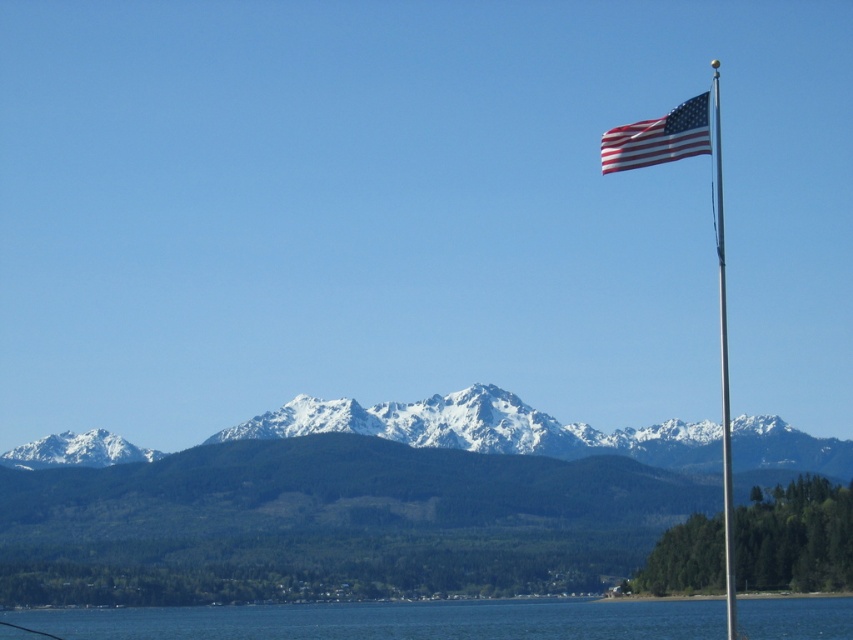
Question: Which point is closer to the camera?

Choices:
 (A) (723, 276)
 (B) (646, 161)

Answer: (B)

Question: Does american flag at upper right have a lesser width compared to silver metallic flag pole at upper right?

Choices:
 (A) yes
 (B) no

Answer: (B)

Question: Can you confirm if american flag at upper right is thinner than silver metallic flag pole at upper right?

Choices:
 (A) no
 (B) yes

Answer: (A)

Question: Is blue water at lower center in front of silver metallic flag pole at upper right?

Choices:
 (A) no
 (B) yes

Answer: (A)

Question: Which point is closer to the camera?

Choices:
 (A) silver metallic flag pole at upper right
 (B) blue water at lower center
 (C) american flag at upper right

Answer: (A)

Question: Which of the following is the farthest from the observer?

Choices:
 (A) silver metallic flag pole at upper right
 (B) blue water at lower center
 (C) american flag at upper right

Answer: (B)